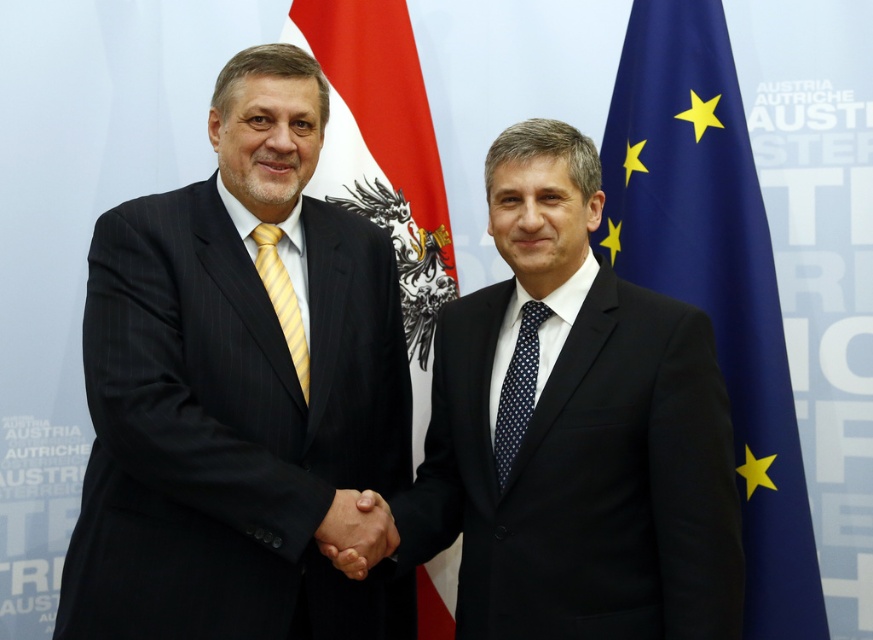
Can you confirm if matte black suit at left is bigger than black matte hand at center?

Correct, matte black suit at left is larger in size than black matte hand at center.

Which is behind, point (356, 304) or point (375, 541)?

Positioned behind is point (356, 304).

This screenshot has height=640, width=873. I want to click on matte black suit at left, so click(238, 388).

Does point (444, 195) come closer to viewer compared to point (495, 440)?

No, (444, 195) is behind (495, 440).

In the scene shown: Between red fabric flag at left and blue dotted tie at center, which one is positioned higher?

red fabric flag at left is higher up.

Describe the element at coordinates (382, 147) in the screenshot. I see `red fabric flag at left` at that location.

You are a GUI agent. You are given a task and a screenshot of the screen. Output one action in this format:
    pyautogui.click(x=<x>, y=<y>)
    Task: Click on the red fabric flag at left
    The image size is (873, 640).
    Given the screenshot: What is the action you would take?
    pyautogui.click(x=382, y=147)

Between black matte suit at center and red fabric flag at left, which one has less height?

black matte suit at center is shorter.

In the scene shown: Does black matte suit at center have a lesser height compared to red fabric flag at left?

Yes.

Is point (487, 456) positioned behind point (368, 13)?

No, it is not.

What are the coordinates of `black matte suit at center` in the screenshot? It's located at (574, 429).